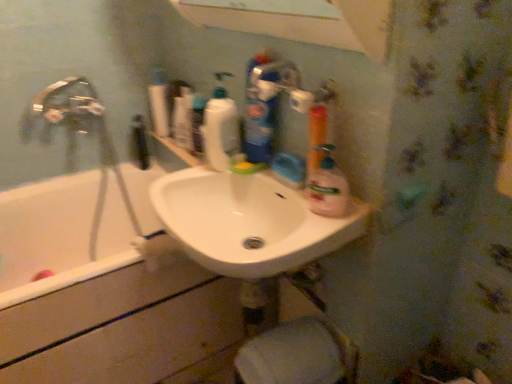
Question: Does translucent plastic spray bottle at center, which is the first cleaning product in right-to-left order, appear on the right side of translucent plastic bottle at upper center, marked as the 2th cleaning product in a back-to-front arrangement?

Choices:
 (A) no
 (B) yes

Answer: (B)

Question: Does translucent plastic spray bottle at center, which is the first cleaning product in right-to-left order, have a greater width compared to translucent plastic bottle at upper center, positioned as the 2th cleaning product in left-to-right order?

Choices:
 (A) yes
 (B) no

Answer: (B)

Question: From the image's perspective, does translucent plastic spray bottle at center, the fourth cleaning product when ordered from left to right, appear higher than translucent plastic bottle at upper center, positioned as the 2th cleaning product in left-to-right order?

Choices:
 (A) no
 (B) yes

Answer: (A)

Question: Is translucent plastic spray bottle at center, the fourth cleaning product when ordered from left to right, oriented towards translucent plastic bottle at upper center, arranged as the 3th cleaning product when viewed from the front?

Choices:
 (A) no
 (B) yes

Answer: (A)

Question: Would you say translucent plastic spray bottle at center, which is counted as the 1th cleaning product, starting from the front, is a long distance from translucent plastic bottle at upper center, arranged as the 3th cleaning product when viewed from the front?

Choices:
 (A) yes
 (B) no

Answer: (B)

Question: In terms of width, does translucent plastic spray bottle at center, which is counted as the 1th cleaning product, starting from the front, look wider or thinner when compared to white glossy sink at center?

Choices:
 (A) wide
 (B) thin

Answer: (B)

Question: Relative to white glossy sink at center, is translucent plastic spray bottle at center, the fourth cleaning product when ordered from left to right, in front or behind?

Choices:
 (A) front
 (B) behind

Answer: (B)

Question: Is translucent plastic spray bottle at center, which is the first cleaning product in right-to-left order, bigger or smaller than white glossy sink at center?

Choices:
 (A) small
 (B) big

Answer: (A)

Question: From a real-world perspective, is translucent plastic spray bottle at center, which is the first cleaning product in right-to-left order, positioned above or below white glossy sink at center?

Choices:
 (A) below
 (B) above

Answer: (B)

Question: From a real-world perspective, is translucent plastic bottle at upper center, arranged as the 3th cleaning product when viewed from the front, physically located above or below white glossy bathtub at left?

Choices:
 (A) above
 (B) below

Answer: (A)

Question: Looking at their shapes, would you say translucent plastic bottle at upper center, positioned as the 2th cleaning product in left-to-right order, is wider or thinner than white glossy bathtub at left?

Choices:
 (A) wide
 (B) thin

Answer: (B)

Question: Is translucent plastic bottle at upper center, marked as the 2th cleaning product in a back-to-front arrangement, taller or shorter than white glossy bathtub at left?

Choices:
 (A) tall
 (B) short

Answer: (B)

Question: Does point (206, 134) appear closer or farther from the camera than point (80, 236)?

Choices:
 (A) closer
 (B) farther

Answer: (A)

Question: Is white glossy bottle at upper center, which appears as the 4th cleaning product when viewed from the right, bigger or smaller than translucent plastic bottle at upper center, marked as the 2th cleaning product in a back-to-front arrangement?

Choices:
 (A) big
 (B) small

Answer: (A)

Question: Relative to translucent plastic bottle at upper center, arranged as the third cleaning product when viewed from the right, is white glossy bottle at upper center, which appears as the 4th cleaning product when viewed from the right, in front or behind?

Choices:
 (A) front
 (B) behind

Answer: (B)